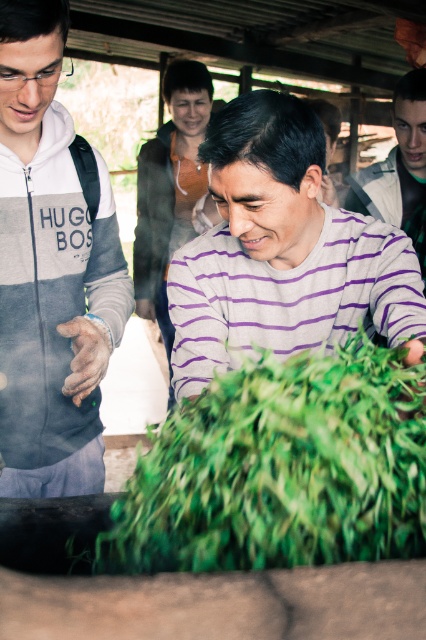
Which is in front, point (66, 316) or point (400, 211)?

Point (66, 316) is in front.

Is point (34, 419) more distant than point (400, 99)?

No, (34, 419) is closer to viewer.

The image size is (426, 640). I want to click on gray fleece jacket at left, so click(x=51, y=269).

Who is positioned more to the right, green leafy vegetable at center or matte orange sweater at upper center?

From the viewer's perspective, green leafy vegetable at center appears more on the right side.

Is green leafy vegetable at center closer to the viewer compared to matte orange sweater at upper center?

Yes, green leafy vegetable at center is closer to the viewer.

Does point (412, 474) lie behind point (189, 140)?

No, it is in front of (189, 140).

Image resolution: width=426 pixels, height=640 pixels. I want to click on green leafy vegetable at center, so click(x=279, y=468).

Can you confirm if matte orange sweater at upper center is smaller than purple striped sweater at center?

No.

Does matte orange sweater at upper center lie behind purple striped sweater at center?

Yes, it is.

Find the location of `matte orange sweater at upper center`. matte orange sweater at upper center is located at coordinates (169, 189).